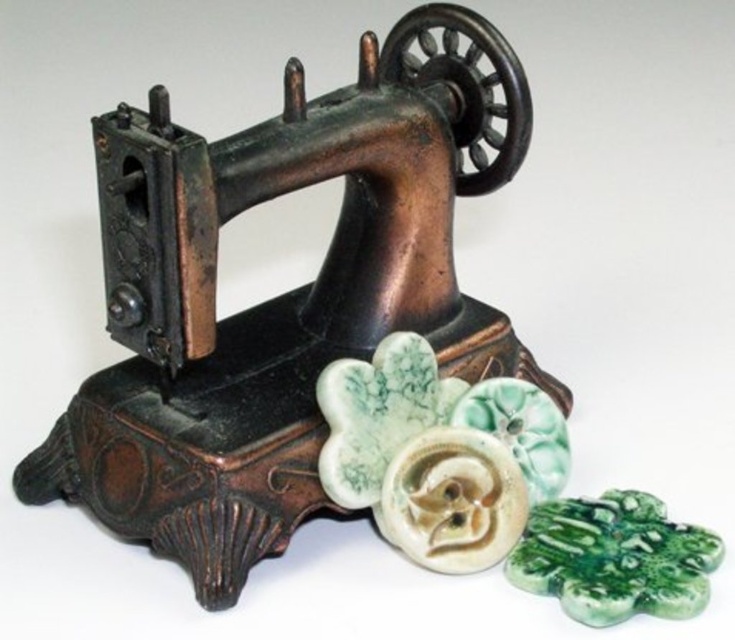
Does copper-bronze sewing machine at center have a greater height compared to green glazed ceramic flower at center?

Yes.

At what (x,y) coordinates should I click in order to perform the action: click on copper-bronze sewing machine at center. Please return your answer as a coordinate pair (x, y). Image resolution: width=735 pixels, height=640 pixels. Looking at the image, I should click on (279, 296).

Can you confirm if green glazed clover at center is positioned above green marble flower at center?

Incorrect, green glazed clover at center is not positioned above green marble flower at center.

I want to click on green glazed clover at center, so click(x=614, y=557).

Which is more to the right, green marble flower at center or green glazed ceramic flower at center?

green glazed ceramic flower at center

The image size is (735, 640). In order to click on green marble flower at center in this screenshot , I will do `click(376, 413)`.

At what (x,y) coordinates should I click in order to perform the action: click on green marble flower at center. Please return your answer as a coordinate pair (x, y). Looking at the image, I should click on (376, 413).